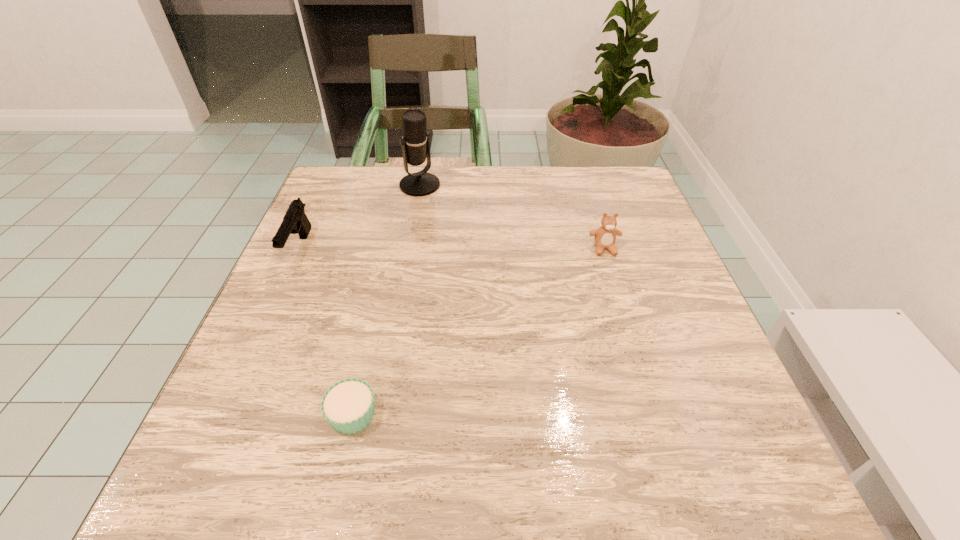
Identify which object is the second closest to the teddy bear. Please provide its 2D coordinates. Your answer should be formatted as a tuple, i.e. [(x, y)], where the tuple contains the x and y coordinates of a point satisfying the conditions above.

[(348, 406)]

Locate an element on the screen. object that is the closest to the pistol is located at coordinates (415, 145).

The width and height of the screenshot is (960, 540). What are the coordinates of `free space that satisfies the following two spatial constraints: 1. on the front-facing side of the leftmost object; 2. on the left side of the nearest object` in the screenshot? It's located at (224, 414).